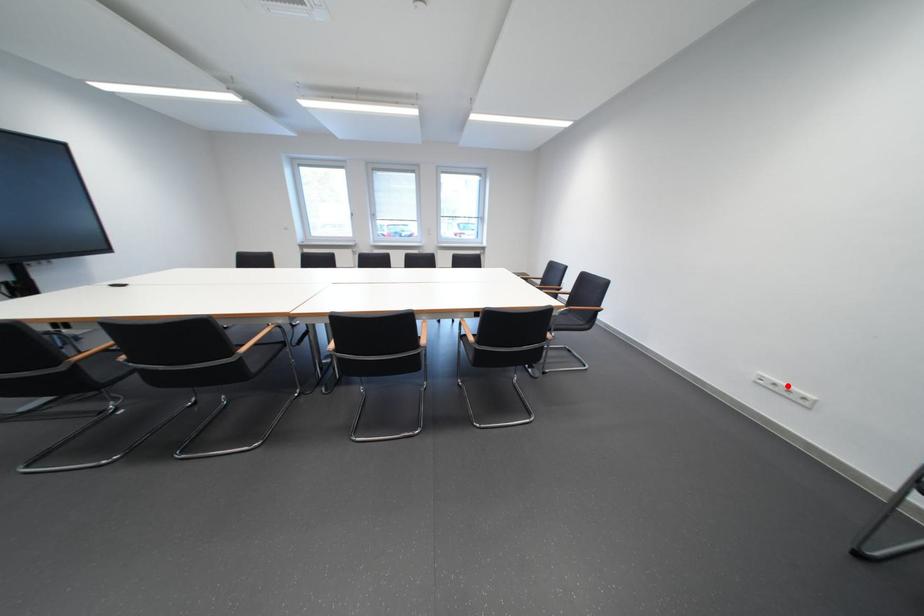
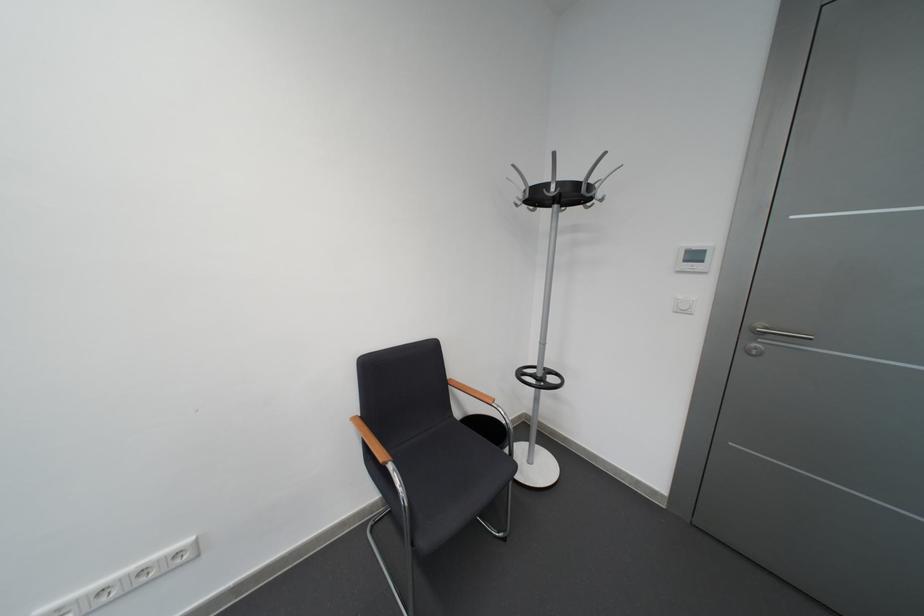
Where in the second image is the point corresponding to the highlighted location from the first image?

(116, 593)